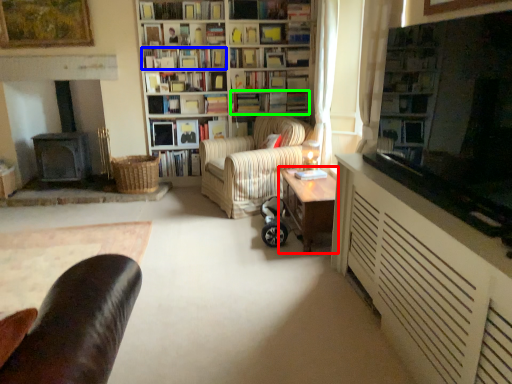
Question: Considering the real-world distances, which object is farthest from table (highlighted by a red box)? book (highlighted by a blue box) or book (highlighted by a green box)?

Choices:
 (A) book
 (B) book

Answer: (A)